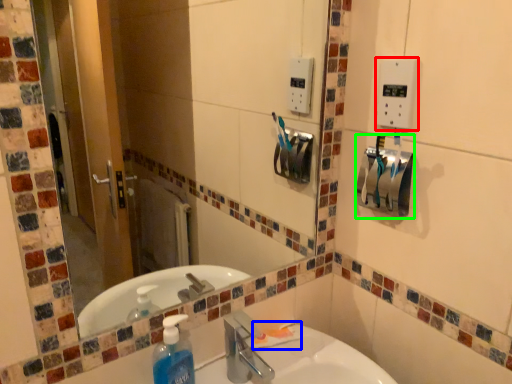
Question: Which is nearer to the light switch (highlighted by a red box)? toothpaste (highlighted by a blue box) or hand dryer (highlighted by a green box).

Choices:
 (A) toothpaste
 (B) hand dryer

Answer: (B)